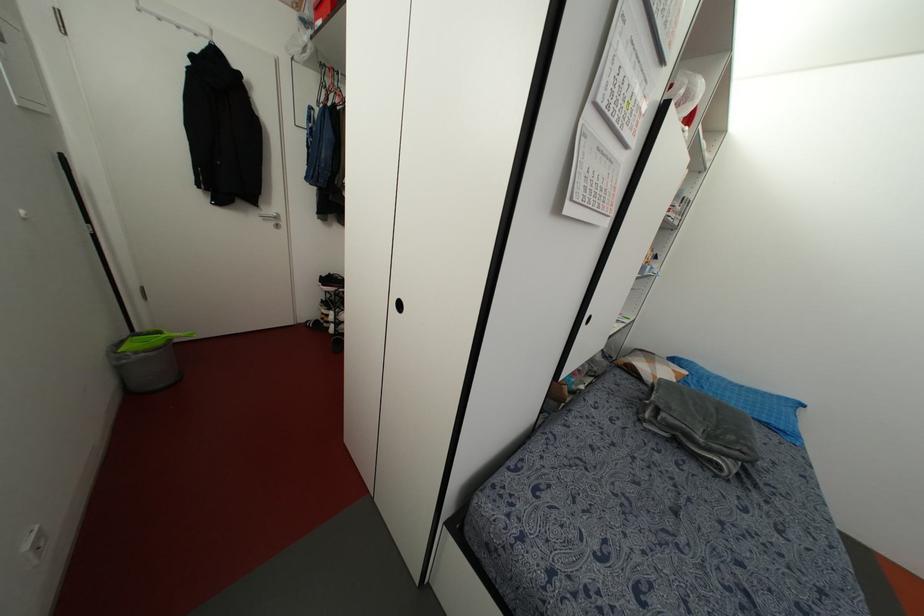
The location [331,310] corresponds to which object?

This point indicates the white and black shoe.